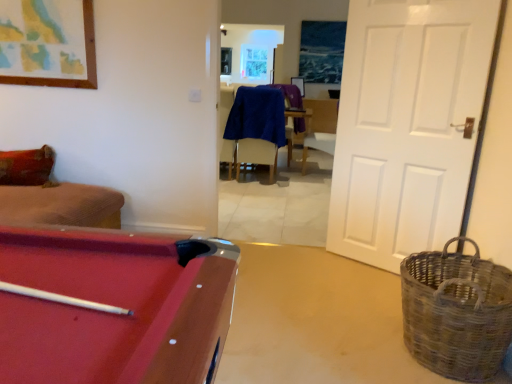
Question: Considering their positions, is rustic woven basket at right located in front of or behind blue fabric armchair at center?

Choices:
 (A) front
 (B) behind

Answer: (A)

Question: Would you say rustic woven basket at right is inside or outside blue fabric armchair at center?

Choices:
 (A) inside
 (B) outside

Answer: (B)

Question: Based on their relative distances, which object is farther from the white matte door at right?

Choices:
 (A) blue fabric armchair at center
 (B) rubberized red pool table at lower left
 (C) rustic woven basket at right
 (D) blue fabric chair at center

Answer: (A)

Question: Which is farther from the blue fabric chair at center?

Choices:
 (A) rubberized red pool table at lower left
 (B) blue fabric armchair at center
 (C) rustic woven basket at right
 (D) white matte door at right

Answer: (C)